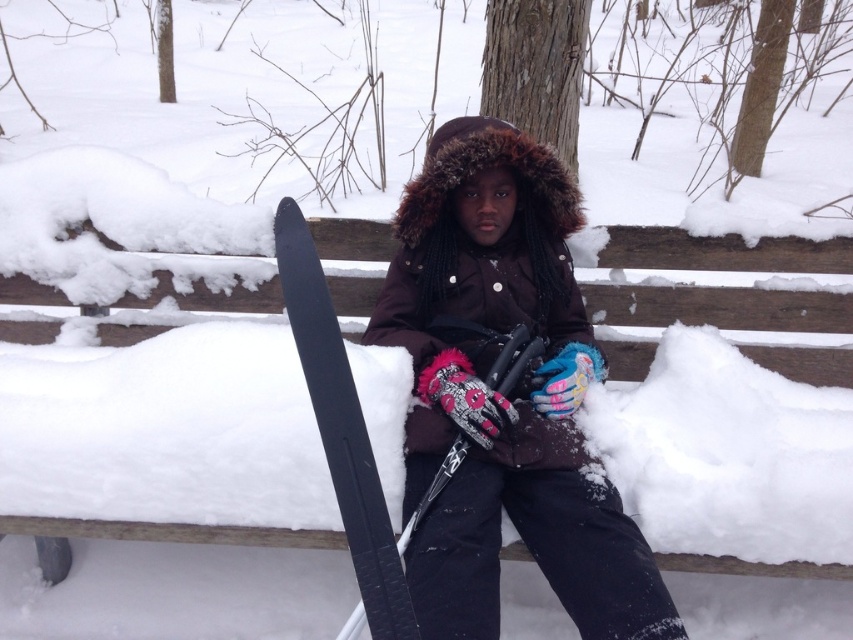
Who is positioned more to the right, dark brown fur-lined coat at center or black matte ski at left?

Positioned to the right is dark brown fur-lined coat at center.

Can you confirm if dark brown fur-lined coat at center is wider than black matte ski at left?

Yes.

Is point (550, 262) more distant than point (289, 284)?

Yes.

Locate an element on the screen. dark brown fur-lined coat at center is located at coordinates (503, 396).